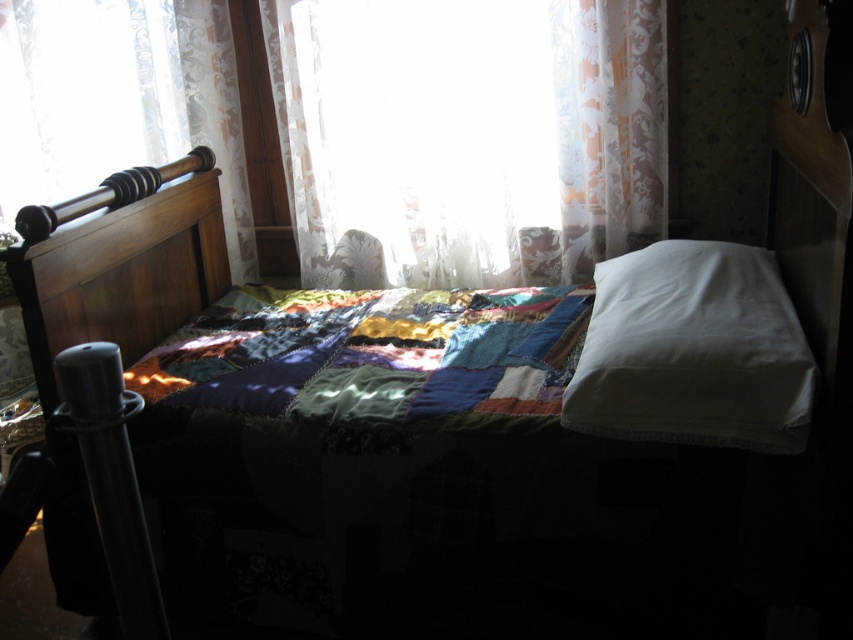
You are standing at the entrance of the bedroom and want to place a 4.5 feet long decorative shelf on the wall behind the patchwork fabric quilt at center. Can you estimate if the shelf will fit without moving the quilt?

The distance of patchwork fabric quilt at center from viewer is 5.03 feet. Since the shelf is 4.5 feet long, which is shorter than the distance from the quilt to the wall, the shelf can be placed behind the quilt without moving it.

You are standing in the bedroom and see two points marked in the image. Which point is closer to you, point (149,225) or point (660,102)?

Point (149,225) is in front of point (660,102), so it is closer to you.

You are arranging a photo shoot in the bedroom and need to position a camera on a tripod. The camera has a 1.2 meter height requirement to capture the entire bed setup. The patchwork fabric quilt at center and the white smooth pillow at center are key elements. Which object should you focus on first to ensure the camera captures both elements without obstruction?

The patchwork fabric quilt at center is further to the viewer than the white smooth pillow at center, so you should focus on the white smooth pillow at center first to avoid it being obscured by the quilt.